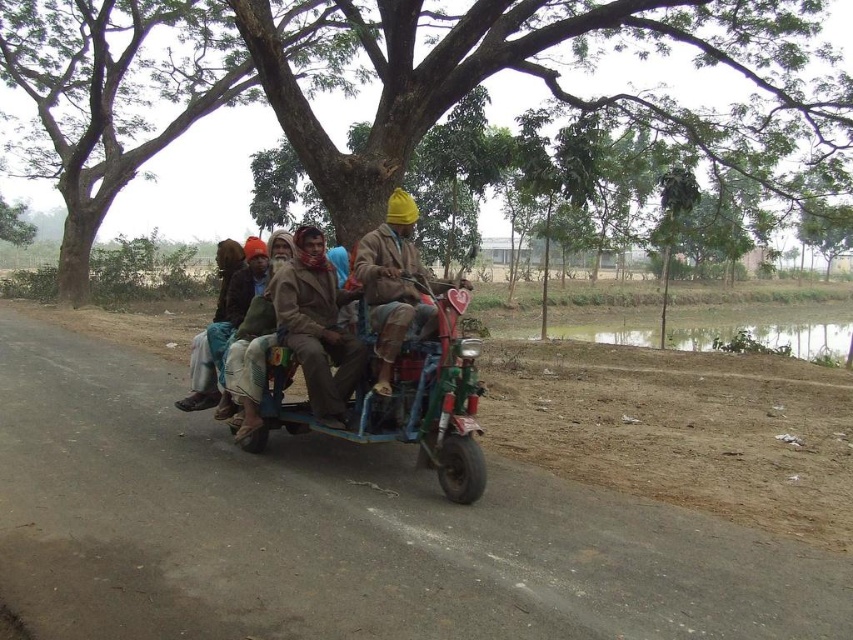
Measure the distance between point (378, 419) and camera.

Point (378, 419) is 17.69 feet away from camera.

Can you confirm if metallic green motorbike at center is shorter than matte brown jacket at center?

Indeed, metallic green motorbike at center has a lesser height compared to matte brown jacket at center.

Image resolution: width=853 pixels, height=640 pixels. Identify the location of metallic green motorbike at center. (398, 396).

Between green leafy tree at center and metallic green motorbike at center, which one has more height?

green leafy tree at center

Can you confirm if green leafy tree at center is positioned to the right of metallic green motorbike at center?

Incorrect, green leafy tree at center is not on the right side of metallic green motorbike at center.

Identify the location of green leafy tree at center. This screenshot has height=640, width=853. (492, 44).

Image resolution: width=853 pixels, height=640 pixels. Identify the location of brown fabric jacket at center. (316, 326).

Who is taller, brown fabric jacket at center or matte brown jacket at center?

Standing taller between the two is matte brown jacket at center.

Between point (297, 321) and point (384, 224), which one is positioned behind?

The point (384, 224) is more distant.

Where is `brown fabric jacket at center`? brown fabric jacket at center is located at coordinates (316, 326).